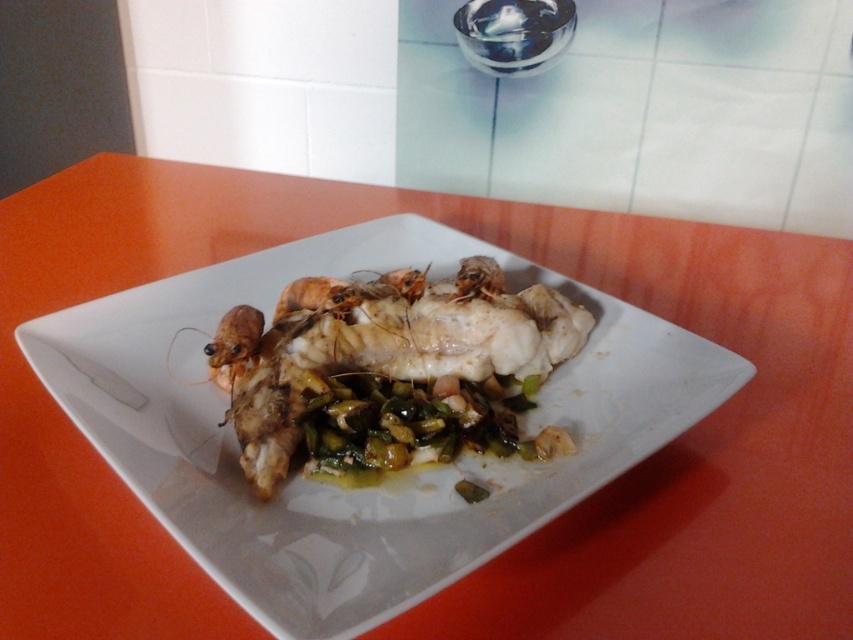
Question: Which of the following is the farthest from the observer?

Choices:
 (A) white paper towel at upper center
 (B) white glossy fish at center

Answer: (A)

Question: Does white glossy fish at center have a lesser width compared to white paper towel at upper center?

Choices:
 (A) no
 (B) yes

Answer: (A)

Question: Which point is farther from the camera taking this photo?

Choices:
 (A) (662, 202)
 (B) (415, 420)

Answer: (A)

Question: Which point appears closest to the camera in this image?

Choices:
 (A) (358, 390)
 (B) (660, 154)

Answer: (A)

Question: Can you confirm if white glossy fish at center is positioned to the left of white paper towel at upper center?

Choices:
 (A) yes
 (B) no

Answer: (A)

Question: Is white glossy fish at center to the left of white paper towel at upper center from the viewer's perspective?

Choices:
 (A) yes
 (B) no

Answer: (A)